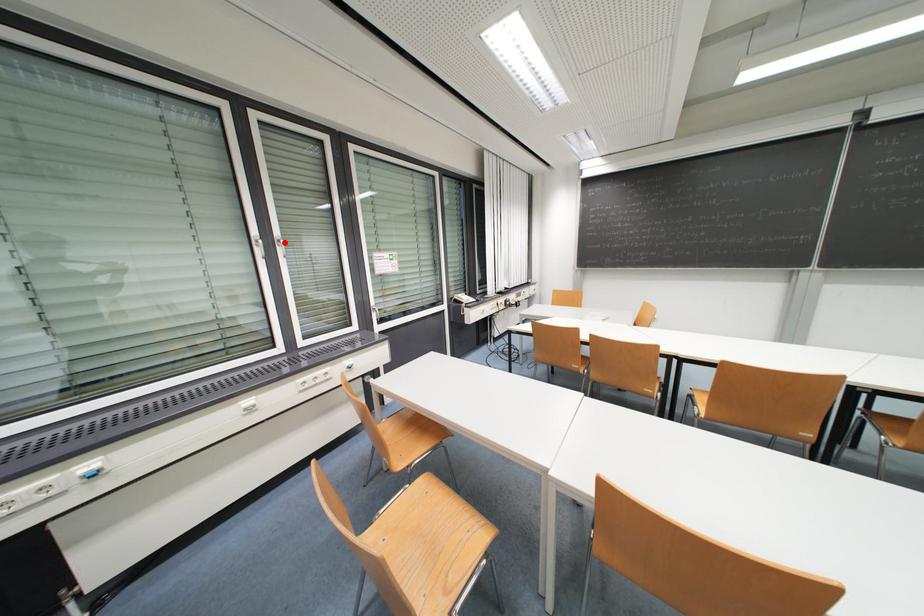
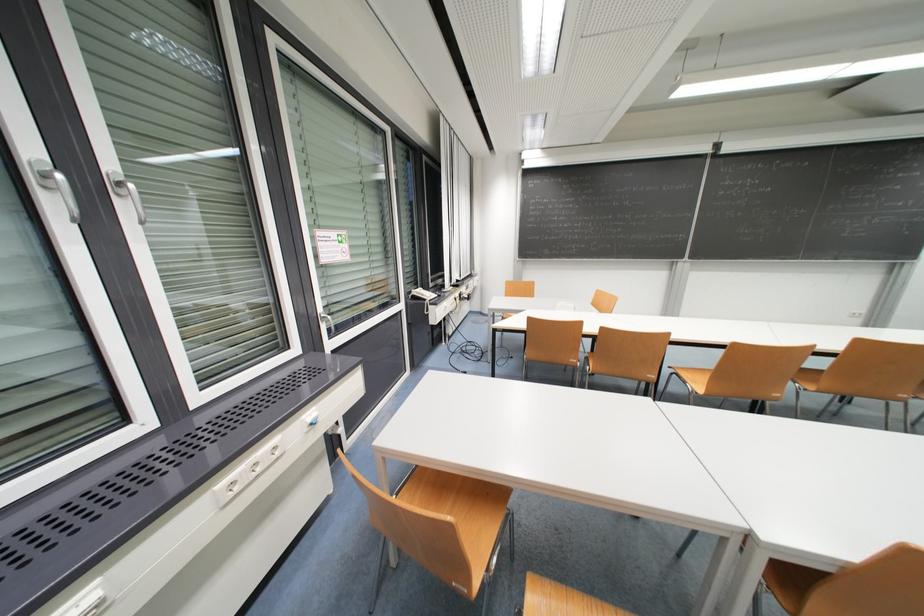
Question: I am providing you with two images of the same scene from different viewpoints. Given a red point in image1, look at the same physical point in image2. Is it:

Choices:
 (A) Closer to the viewpoint
 (B) Farther from the viewpoint

Answer: (B)